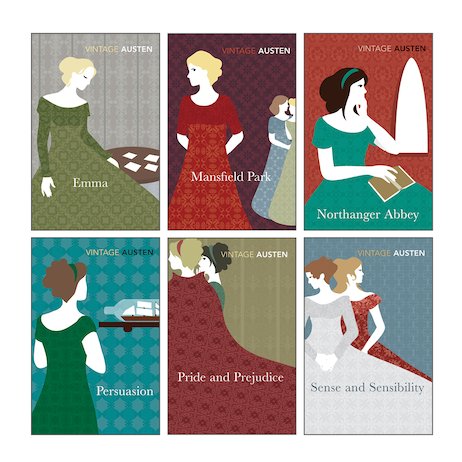
You are a GUI agent. You are given a task and a screenshot of the screen. Output one action in this format:
    pyautogui.click(x=<x>, y=<y>)
    Task: Click on the book
    This screenshot has height=462, width=462.
    Given the screenshot: What is the action you would take?
    pyautogui.click(x=390, y=190)